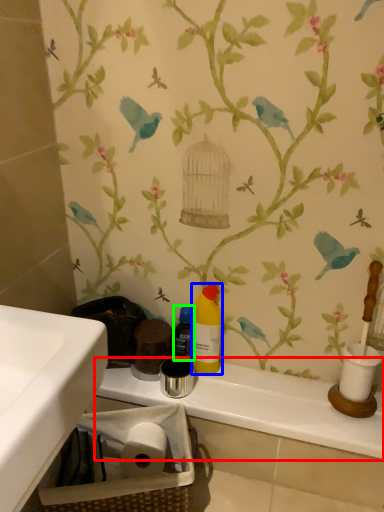
Question: Which object is the farthest from counter top (highlighted by a red box)? Choose among these: cleaning product (highlighted by a blue box) or bottle (highlighted by a green box).

Choices:
 (A) cleaning product
 (B) bottle

Answer: (B)